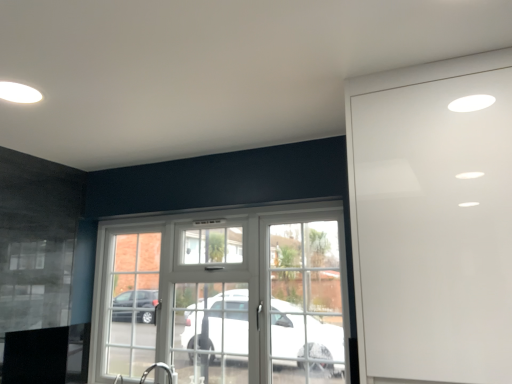
What do you see at coordinates (224, 297) in the screenshot? I see `white glass door at center` at bounding box center [224, 297].

This screenshot has width=512, height=384. In order to click on white glass door at center in this screenshot , I will do `click(224, 297)`.

Describe the element at coordinates (433, 221) in the screenshot. I see `white glossy cabinet at right` at that location.

Identify the location of white glossy cabinet at right. (433, 221).

What are the coordinates of `white glass door at center` in the screenshot? It's located at (224, 297).

Does white glass door at center appear on the right side of white glossy cabinet at right?

No.

Which object is closer to the camera, white glass door at center or white glossy cabinet at right?

white glossy cabinet at right.

Does point (259, 254) appear closer or farther from the camera than point (486, 351)?

Point (259, 254) appears to be farther away from the viewer than point (486, 351).

From the image's perspective, is white glass door at center located above or below white glossy cabinet at right?

Clearly, from the image's perspective, white glass door at center is below white glossy cabinet at right.

From a real-world perspective, is white glass door at center positioned under white glossy cabinet at right based on gravity?

Indeed, from a real-world perspective, white glass door at center is positioned beneath white glossy cabinet at right.

Looking at their sizes, would you say white glass door at center is wider or thinner than white glossy cabinet at right?

Considering their sizes, white glass door at center looks slimmer than white glossy cabinet at right.

Is white glass door at center taller or shorter than white glossy cabinet at right?

In the image, white glass door at center appears to be shorter than white glossy cabinet at right.

Between white glass door at center and white glossy cabinet at right, which one has larger size?

white glossy cabinet at right.

Is white glass door at center positioned beyond the bounds of white glossy cabinet at right?

That's correct, white glass door at center is outside of white glossy cabinet at right.

Is white glass door at center not close to white glossy cabinet at right?

Yes, white glass door at center and white glossy cabinet at right are located far from each other.

Could you tell me if white glass door at center is turned towards white glossy cabinet at right?

No, white glass door at center is not aimed at white glossy cabinet at right.

How many degrees apart are the facing directions of white glass door at center and white glossy cabinet at right?

The angular difference between white glass door at center and white glossy cabinet at right is 1.49 degrees.

Measure the distance between white glass door at center and white glossy cabinet at right.

They are 3.76 feet apart.

In order to click on window below the white glossy cabinet at right (from a real-world perspective) in this screenshot , I will do `click(224, 297)`.

Is white glossy cabinet at right to the right of white glass door at center from the viewer's perspective?

Yes.

In the image, is white glossy cabinet at right positioned in front of or behind white glass door at center?

Visually, white glossy cabinet at right is located in front of white glass door at center.

Which is nearer, [467,75] or [245,299]?

The point [467,75] is more forward.

From the image's perspective, between white glossy cabinet at right and white glass door at center, who is located below?

white glass door at center appears lower in the image.

From a real-world perspective, which object stands above the other?

white glossy cabinet at right.

Based on the photo, can you confirm if white glossy cabinet at right is wider than white glass door at center?

Yes, white glossy cabinet at right is wider than white glass door at center.

Which of these two, white glossy cabinet at right or white glass door at center, stands taller?

white glossy cabinet at right.

Between white glossy cabinet at right and white glass door at center, which one has larger size?

white glossy cabinet at right.

Would you say white glossy cabinet at right is outside white glass door at center?

That's correct, white glossy cabinet at right is outside of white glass door at center.

From the picture: Is white glossy cabinet at right placed right next to white glass door at center?

No, white glossy cabinet at right is not making contact with white glass door at center.

Is white glossy cabinet at right aimed at white glass door at center?

No, white glossy cabinet at right is not turned towards white glass door at center.

What's the angular difference between white glossy cabinet at right and white glass door at center's facing directions?

The facing directions of white glossy cabinet at right and white glass door at center are 1.49 degrees apart.

Looking at this image, measure the distance from white glossy cabinet at right to white glass door at center.

white glossy cabinet at right is 1.15 meters away from white glass door at center.

Locate an element on the screen. window behind the white glossy cabinet at right is located at coordinates (224, 297).

The image size is (512, 384). I want to click on garage door above the white glass door at center (from the image's perspective), so click(x=433, y=221).

I want to click on window behind the white glossy cabinet at right, so click(x=224, y=297).